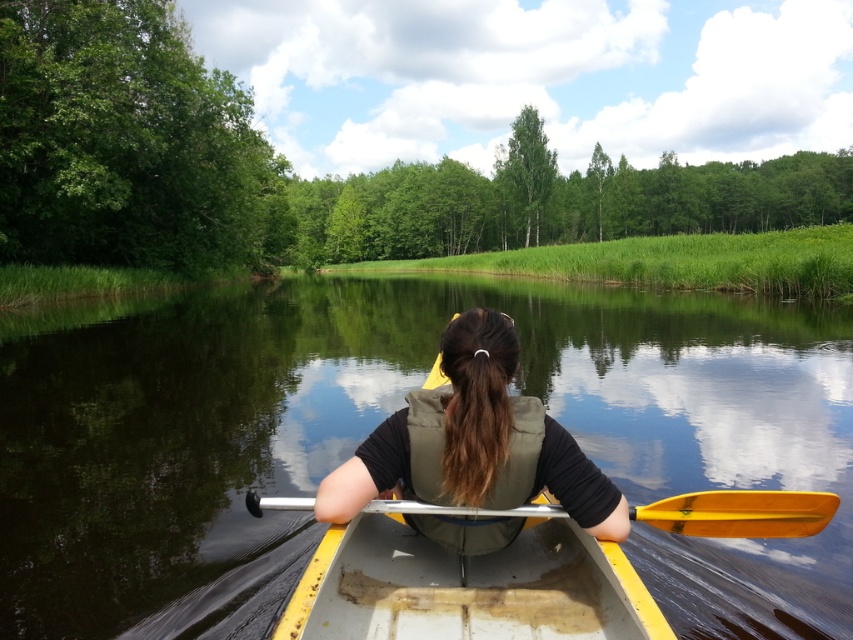
Does matte green life vest at center have a smaller size compared to yellow plastic paddle at center?

Actually, matte green life vest at center might be larger than yellow plastic paddle at center.

Is point (448, 346) positioned before point (735, 512)?

Yes, point (448, 346) is in front of point (735, 512).

Find the location of a particular element. The width and height of the screenshot is (853, 640). matte green life vest at center is located at coordinates (474, 403).

I want to click on smooth water at center, so click(x=381, y=419).

Between point (694, 628) and point (630, 506), which one is positioned in front?

Positioned in front is point (630, 506).

Between point (747, 374) and point (663, 516), which one is positioned behind?

Positioned behind is point (747, 374).

You are a GUI agent. You are given a task and a screenshot of the screen. Output one action in this format:
    pyautogui.click(x=<x>, y=<y>)
    Task: Click on the smooth water at center
    This screenshot has height=640, width=853.
    Given the screenshot: What is the action you would take?
    pyautogui.click(x=381, y=419)

Is smooth water at center smaller than yellow plastic canoe at center?

No, smooth water at center is not smaller than yellow plastic canoe at center.

Does smooth water at center appear on the left side of yellow plastic canoe at center?

Yes, smooth water at center is to the left of yellow plastic canoe at center.

Locate an element on the screen. smooth water at center is located at coordinates (381, 419).

This screenshot has height=640, width=853. In order to click on smooth water at center in this screenshot , I will do `click(381, 419)`.